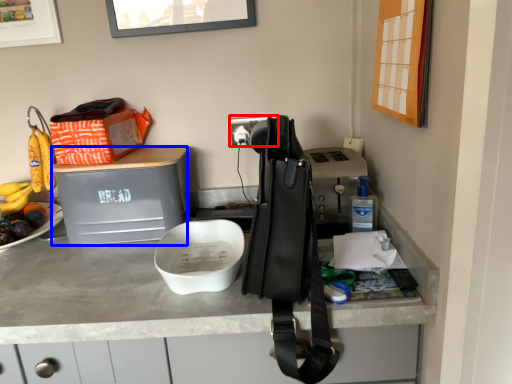
Question: Which object is further to the camera taking this photo, power outlet (highlighted by a red box) or wide (highlighted by a blue box)?

Choices:
 (A) power outlet
 (B) wide

Answer: (A)